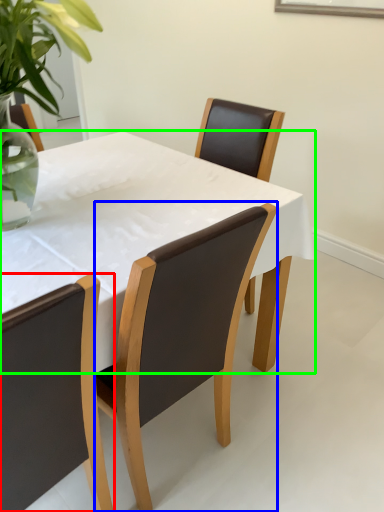
Question: Based on their relative distances, which object is nearer to chair (highlighted by a red box)? Choose from chair (highlighted by a blue box) and kitchen & dining room table (highlighted by a green box).

Choices:
 (A) chair
 (B) kitchen & dining room table

Answer: (A)